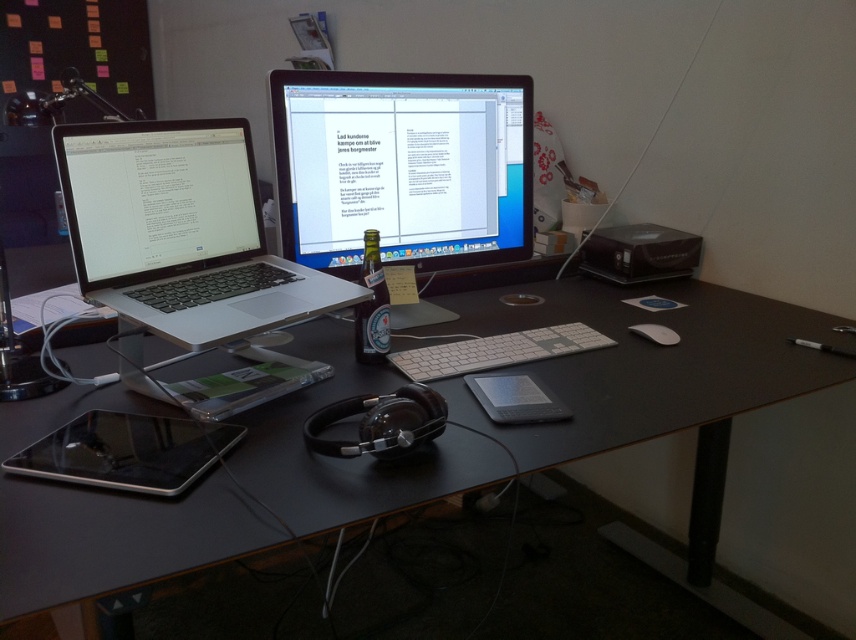
Question: Considering the relative positions of matte black laptop at left and white aluminum keyboard at center in the image provided, where is matte black laptop at left located with respect to white aluminum keyboard at center?

Choices:
 (A) left
 (B) right

Answer: (A)

Question: Which object is positioned farthest from the matte black laptop at left?

Choices:
 (A) white aluminum keyboard at center
 (B) black plastic computer desk at center
 (C) satin black monitor at center
 (D) silver metallic laptop at left

Answer: (A)

Question: Does satin black monitor at center come in front of silver metallic laptop at left?

Choices:
 (A) yes
 (B) no

Answer: (B)

Question: Which of these objects is positioned closest to the matte black laptop at left?

Choices:
 (A) white matte mouse at center
 (B) black plastic computer desk at center
 (C) silver metallic laptop at left

Answer: (C)

Question: Which object appears closest to the camera in this image?

Choices:
 (A) matte black laptop at left
 (B) black plastic computer desk at center

Answer: (B)

Question: Considering the relative positions of silver metallic laptop at left and matte black laptop at left in the image provided, where is silver metallic laptop at left located with respect to matte black laptop at left?

Choices:
 (A) left
 (B) right

Answer: (B)